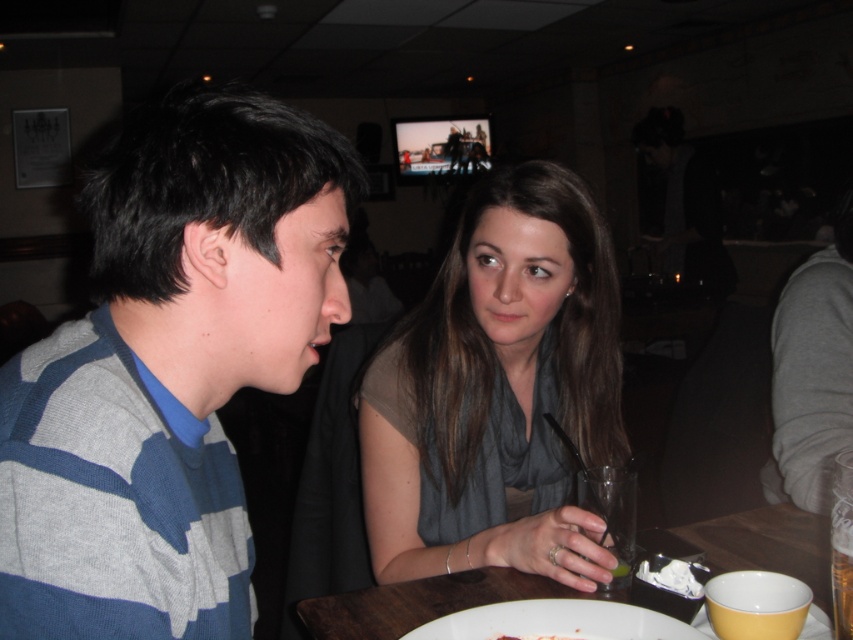
Question: Which object is farther from the camera taking this photo?

Choices:
 (A) wooden table at center
 (B) clear glass at lower center

Answer: (B)

Question: Can you confirm if striped knit sweater at left is positioned below matte gray scarf at center?

Choices:
 (A) no
 (B) yes

Answer: (A)

Question: Which object is farther from the camera taking this photo?

Choices:
 (A) striped knit sweater at left
 (B) wooden table at center

Answer: (B)

Question: Does matte gray scarf at center appear on the left side of white matte plate at lower center?

Choices:
 (A) yes
 (B) no

Answer: (B)

Question: Based on their relative distances, which object is farther from the white matte plate at lower center?

Choices:
 (A) wooden table at center
 (B) smooth white plate at center
 (C) matte gray scarf at center

Answer: (C)

Question: Is striped knit sweater at left smaller than smooth white plate at center?

Choices:
 (A) no
 (B) yes

Answer: (A)